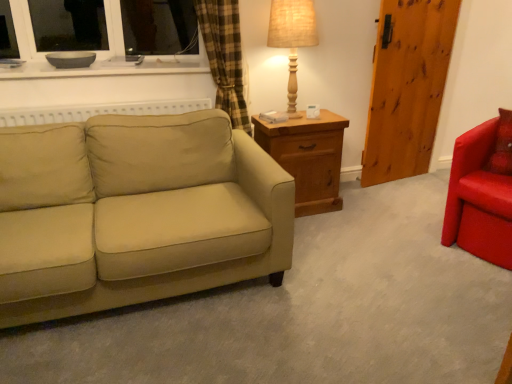
This screenshot has height=384, width=512. Identify the location of vacant space that is to the left of shiny red armchair at right. (407, 238).